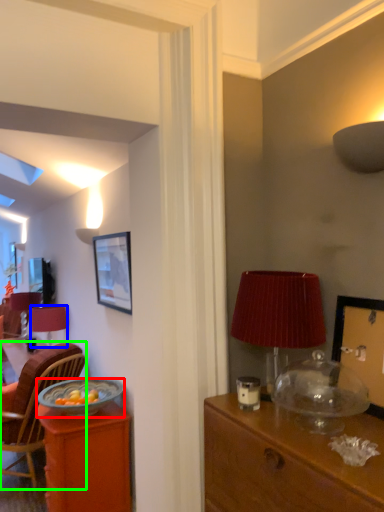
Question: Which object is positioned closest to bowl (highlighted by a red box)? Select from lamp (highlighted by a blue box) and chair (highlighted by a green box).

Choices:
 (A) lamp
 (B) chair

Answer: (B)